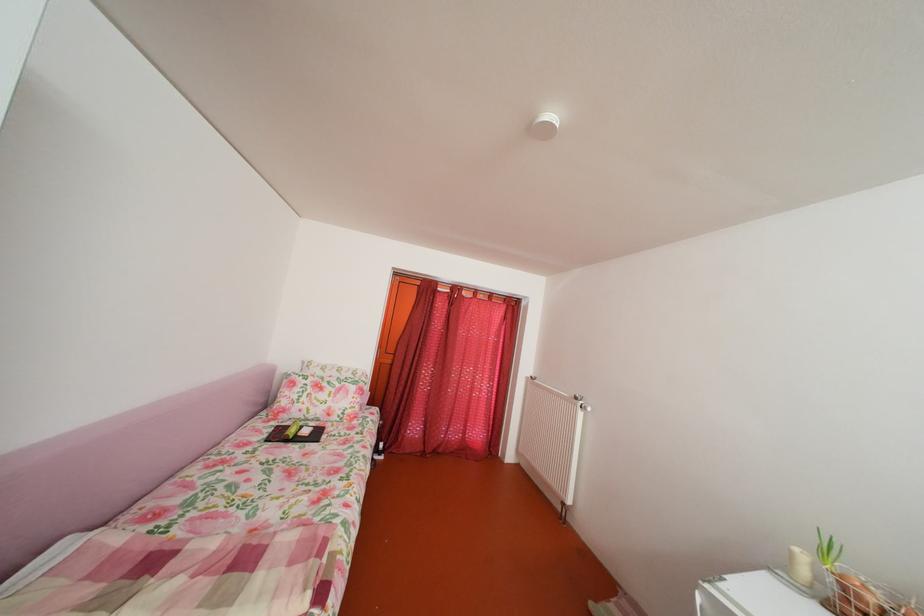
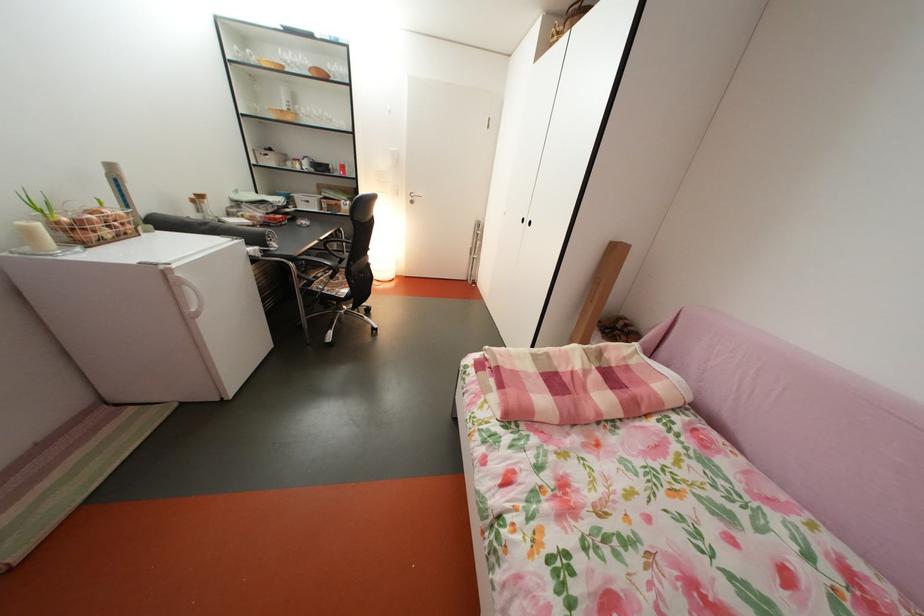
Locate, in the second image, the point that corresponds to the point at 803,561 in the first image.

(41, 238)